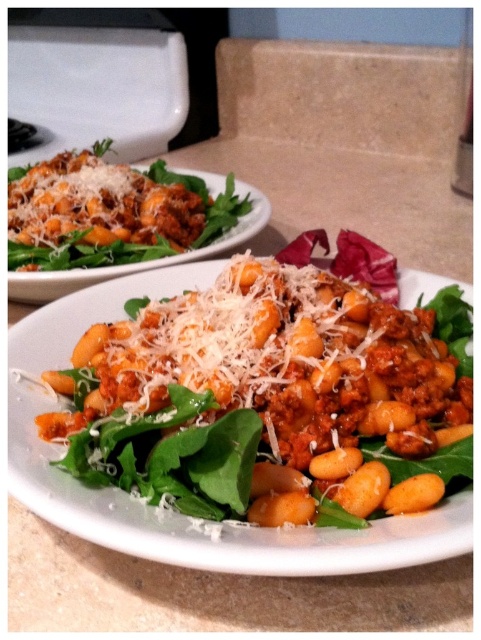
Which is above, matte orange gnocchi at center or matte brown gnocchi at center?

matte brown gnocchi at center is higher up.

Does matte orange gnocchi at center have a larger size compared to matte brown gnocchi at center?

Actually, matte orange gnocchi at center might be smaller than matte brown gnocchi at center.

Between point (252, 531) and point (257, 195), which one is positioned behind?

Point (257, 195)

You are a GUI agent. You are given a task and a screenshot of the screen. Output one action in this format:
    pyautogui.click(x=<x>, y=<y>)
    Task: Click on the matte orange gnocchi at center
    The image size is (481, 640).
    Given the screenshot: What is the action you would take?
    coord(171,509)